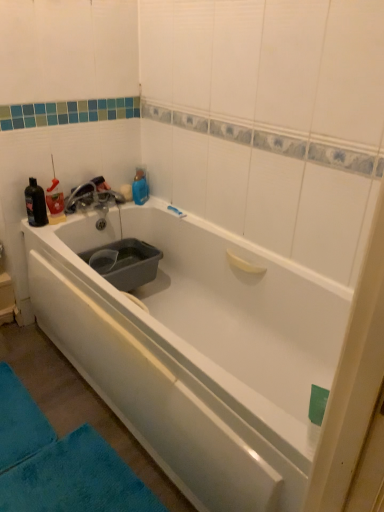
Where is `free spot above gray plastic basin at left (from a real-world perspective)`? This screenshot has height=512, width=384. free spot above gray plastic basin at left (from a real-world perspective) is located at coordinates (101, 248).